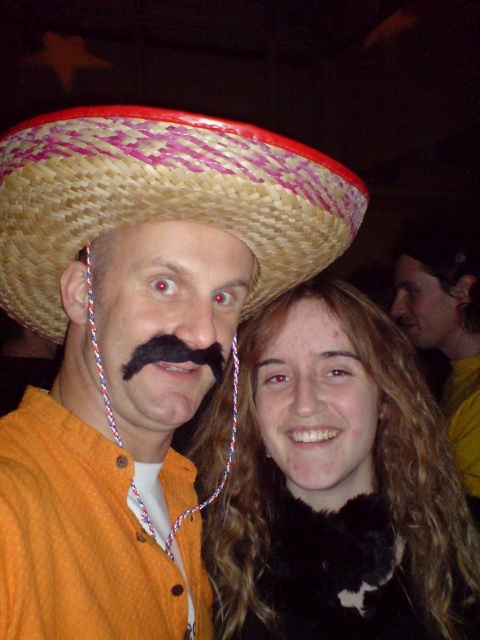
You are a photographer trying to adjust the lighting for a photo shoot. You notice the woven straw sombrero at upper center and the black fuzzy mustache at center. Which object is positioned to the left of the other?

The woven straw sombrero at upper center is to the left of the black fuzzy mustache at center.

You are a photographer adjusting your camera settings to focus on both the black fur coat at center and the black fuzzy mustache at center. Which object should you focus on first to ensure proper depth of field?

The black fur coat at center is closer to you than the black fuzzy mustache at center, so you should focus on the black fur coat at center first to ensure proper depth of field.